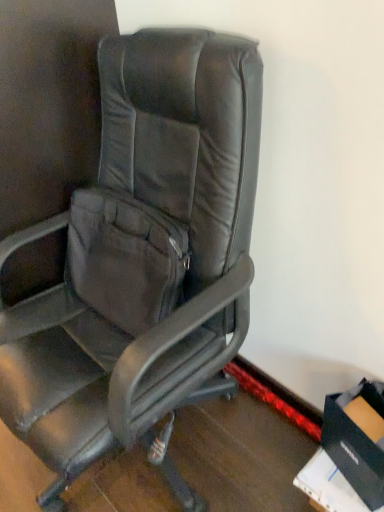
Question: Is black leather chair at center wider or thinner than black cardboard box at lower right?

Choices:
 (A) wide
 (B) thin

Answer: (A)

Question: Is black leather chair at center inside or outside of black cardboard box at lower right?

Choices:
 (A) outside
 (B) inside

Answer: (A)

Question: In terms of size, does black leather chair at center appear bigger or smaller than black cardboard box at lower right?

Choices:
 (A) small
 (B) big

Answer: (B)

Question: Considering the positions of black cardboard box at lower right and black leather chair at center in the image, is black cardboard box at lower right taller or shorter than black leather chair at center?

Choices:
 (A) short
 (B) tall

Answer: (A)

Question: Considering the positions of black cardboard box at lower right and black leather chair at center in the image, is black cardboard box at lower right bigger or smaller than black leather chair at center?

Choices:
 (A) big
 (B) small

Answer: (B)

Question: From the image's perspective, relative to black leather chair at center, is black cardboard box at lower right above or below?

Choices:
 (A) below
 (B) above

Answer: (A)

Question: Is point (337, 434) positioned closer to the camera than point (147, 195)?

Choices:
 (A) closer
 (B) farther

Answer: (A)